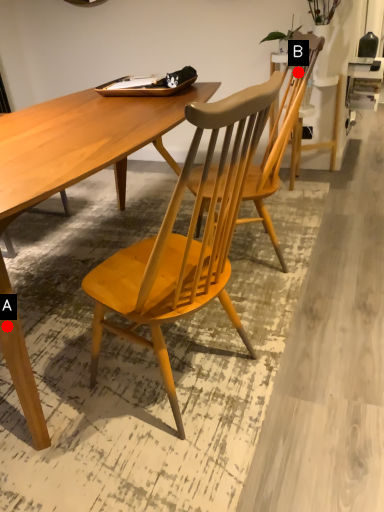
Question: Two points are circled on the image, labeled by A and B beside each circle. Which point is farther from the camera taking this photo?

Choices:
 (A) A is further
 (B) B is further

Answer: (B)